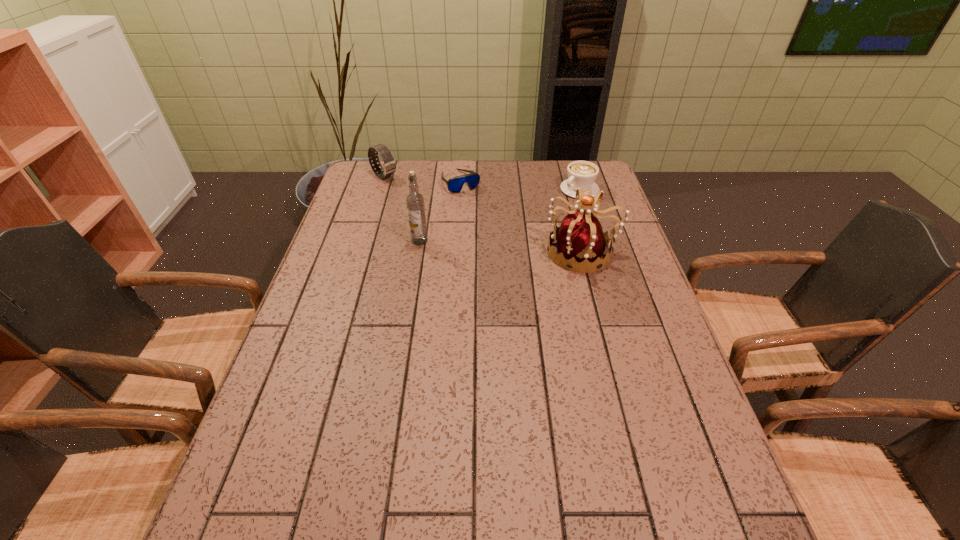
Locate an element on the screen. vacant space situated on the front-facing side of the tiara is located at coordinates (443, 252).

Locate an element on the screen. The image size is (960, 540). vacant space situated 0.200m on the front-facing side of the tiara is located at coordinates (476, 252).

The image size is (960, 540). What are the coordinates of `vacant space located 0.110m on the front-facing side of the tiara` in the screenshot? It's located at (507, 252).

I want to click on vacant area located 0.200m to the right of the cappuccino's handle, so click(x=531, y=221).

Identify the location of free space located to the right of the cappuccino's handle. (492, 247).

Find the location of a particular element. blank space located 0.310m to the right of the cappuccino's handle is located at coordinates (508, 237).

This screenshot has width=960, height=540. Find the location of `vacant area situated on the front-facing side of the third object from right to left`. vacant area situated on the front-facing side of the third object from right to left is located at coordinates (503, 241).

Locate an element on the screen. The width and height of the screenshot is (960, 540). vacant space situated on the front-facing side of the third object from right to left is located at coordinates (502, 239).

This screenshot has width=960, height=540. I want to click on free space located 0.090m on the front-facing side of the third object from right to left, so click(x=478, y=206).

This screenshot has height=540, width=960. I want to click on blank space located 0.150m on the face of the watch, so click(x=418, y=199).